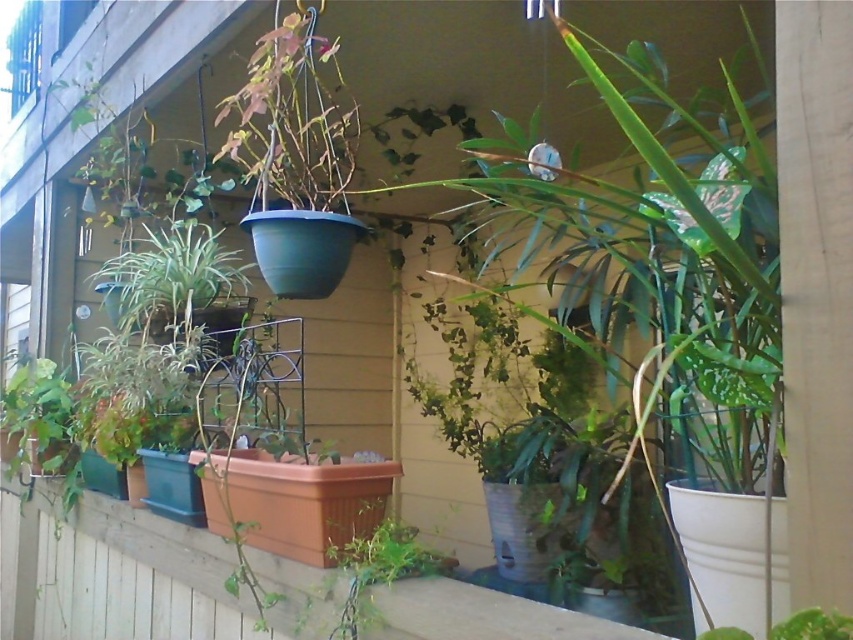
Between green matte hanging planter at upper center and terracotta plastic window box at center, which one appears on the right side from the viewer's perspective?

terracotta plastic window box at center

Find the location of `green matte hanging planter at upper center`. green matte hanging planter at upper center is located at coordinates (292, 120).

Does point (264, 193) lie in front of point (129, 314)?

Yes, it is.

Is green matte hanging planter at upper center behind green matte plant at left?

No, green matte hanging planter at upper center is in front of green matte plant at left.

Is point (265, 195) positioned after point (164, 330)?

No, it is in front of (164, 330).

This screenshot has width=853, height=640. Find the location of `green matte hanging planter at upper center`. green matte hanging planter at upper center is located at coordinates (292, 120).

Which of these two, terracotta plastic window box at center or green matte plant at left, stands shorter?

Standing shorter between the two is terracotta plastic window box at center.

Which is above, terracotta plastic window box at center or green matte plant at left?

Positioned higher is green matte plant at left.

The height and width of the screenshot is (640, 853). In order to click on terracotta plastic window box at center in this screenshot , I will do `click(306, 500)`.